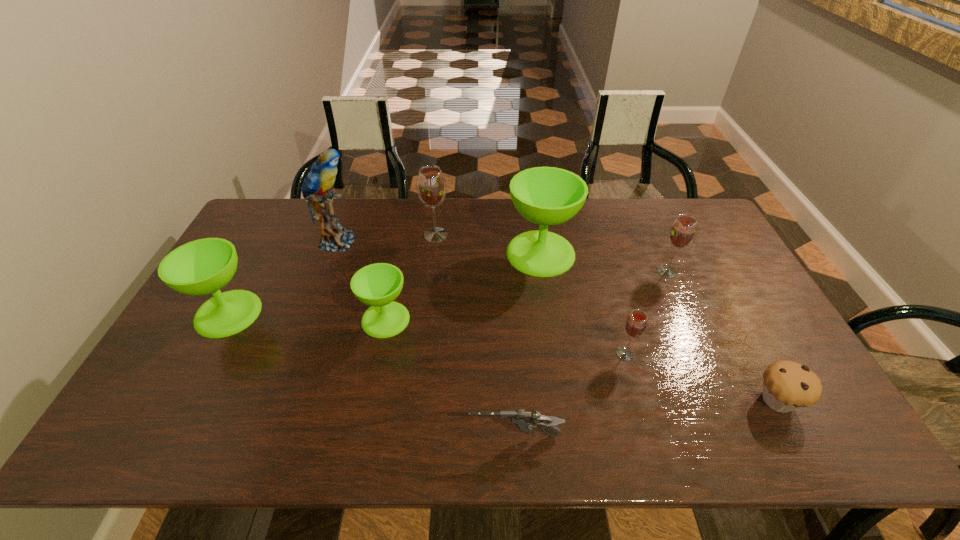
Image resolution: width=960 pixels, height=540 pixels. I want to click on parrot, so click(316, 186).

This screenshot has height=540, width=960. I want to click on the second object from left to right, so click(x=316, y=186).

Find the location of a particular element. The image size is (960, 540). the fourth wineglass from left to right is located at coordinates (547, 196).

The image size is (960, 540). Find the location of `the biggest green wineglass`. the biggest green wineglass is located at coordinates (547, 196).

You are a GUI agent. You are given a task and a screenshot of the screen. Output one action in this format:
    pyautogui.click(x=<x>, y=<y>)
    Task: Click on the biggest red wineglass
    
    Given the screenshot: What is the action you would take?
    pyautogui.click(x=431, y=186)

The height and width of the screenshot is (540, 960). What are the coordinates of `the farthest red wineglass` in the screenshot? It's located at point(431,186).

Identify the location of the rightmost red wineglass. (682, 232).

Identify the location of the second smallest red wineglass. This screenshot has height=540, width=960. (682, 232).

You are a GUI agent. You are given a task and a screenshot of the screen. Output one action in this format:
    pyautogui.click(x=<x>, y=<y>)
    Task: Click on the leftmost object
    Image resolution: width=960 pixels, height=540 pixels.
    Given the screenshot: What is the action you would take?
    pyautogui.click(x=204, y=266)

Locate an element on the screen. Image resolution: width=960 pixels, height=540 pixels. the second biggest green wineglass is located at coordinates (204, 266).